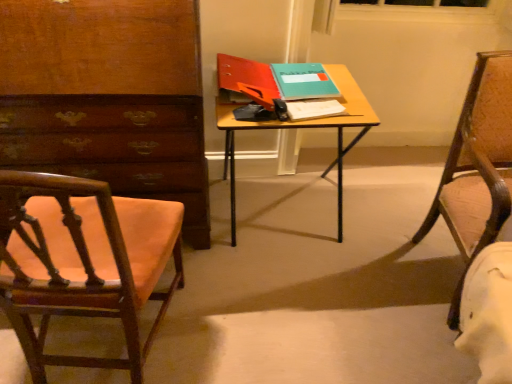
Question: From a real-world perspective, is white paper notepad at center above or below leather-like brown chair at right, the first chair from the right?

Choices:
 (A) below
 (B) above

Answer: (B)

Question: In the image, is white paper notepad at center positioned in front of or behind leather-like brown chair at right, the first chair from the right?

Choices:
 (A) behind
 (B) front

Answer: (A)

Question: Which object is positioned farthest from the wooden chair at left, marked as the 2th chair in a right-to-left arrangement?

Choices:
 (A) white paper notepad at center
 (B) teal matte book at center, acting as the 1th book starting from the right
 (C) wooden desk at center
 (D) matte red folder at center, the 2th book viewed from the right
 (E) leather-like brown chair at right, which is the second chair from left to right

Answer: (E)

Question: Which of these objects is positioned closest to the wooden desk at center?

Choices:
 (A) matte red folder at center, the 2th book viewed from the right
 (B) leather-like brown chair at right, the first chair from the right
 (C) wooden chair at left, acting as the first chair starting from the left
 (D) teal matte book at center, the 2th book from the left
 (E) white paper notepad at center

Answer: (E)